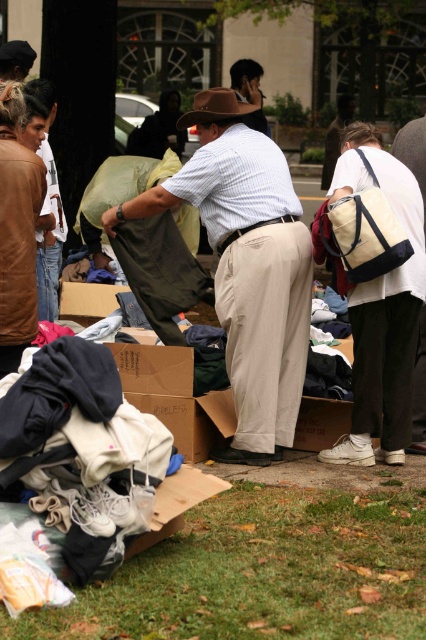
You are standing at the origin point of the coordinate system. You want to place a new box of supplies at the green grass at lower center. What are the coordinates where you should place the box?

The coordinates for the green grass at lower center are at point [262,573], so you should place the box there.

You are organizing a charity event and need to pack items into a small backpack. You have a canvas tote bag at center right and a matte brown hat at center. Which item should you choose to fit into the backpack if you want to take the smaller one?

The matte brown hat at center is smaller than the canvas tote bag at center right, so you should choose the matte brown hat at center to fit into the backpack.

You are standing at the edge of the grassy area in the scene. There is a point labeled as point (262, 573). Is this point located on the green grass at lower center?

Yes, the green grass at lower center is represented by point (262, 573), so the point is located on the green grass at lower center.